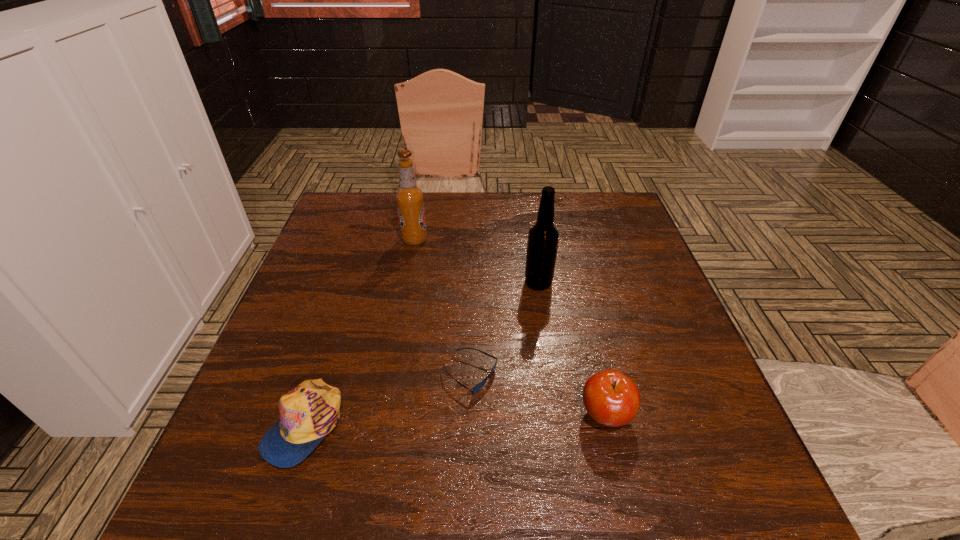
Locate an element on the screen. Image resolution: width=960 pixels, height=540 pixels. empty location between the third object from right to left and the leftmost object is located at coordinates (387, 400).

Where is `vacant region between the cap and the shortest object`? The image size is (960, 540). vacant region between the cap and the shortest object is located at coordinates (387, 400).

The width and height of the screenshot is (960, 540). In order to click on free area in between the third shortest object and the leftmost object in this screenshot , I will do `click(455, 420)`.

Locate an element on the screen. The width and height of the screenshot is (960, 540). object that ranks as the second closest to the farthest object is located at coordinates (474, 390).

Locate an element on the screen. object that can be found as the second closest to the second farthest object is located at coordinates (409, 198).

You are a GUI agent. You are given a task and a screenshot of the screen. Output one action in this format:
    pyautogui.click(x=<x>, y=<y>)
    Task: Click on the free space that satisfies the following two spatial constraints: 1. on the front label of the left beer bottle; 2. on the bill of the fourth tallest object
    
    Given the screenshot: What is the action you would take?
    pyautogui.click(x=379, y=425)

Identify the location of vacant space that satisfies the following two spatial constraints: 1. on the back side of the rightmost object; 2. at the front of the third object from right to left showing the lenses. (596, 376).

Where is `vacant space that satisfies the following two spatial constraints: 1. on the back side of the nearer beer bottle; 2. on the front label of the farthest object`? The width and height of the screenshot is (960, 540). vacant space that satisfies the following two spatial constraints: 1. on the back side of the nearer beer bottle; 2. on the front label of the farthest object is located at coordinates (532, 240).

I want to click on blank space that satisfies the following two spatial constraints: 1. on the back side of the third shortest object; 2. at the front of the third object from right to left showing the lenses, so click(x=596, y=376).